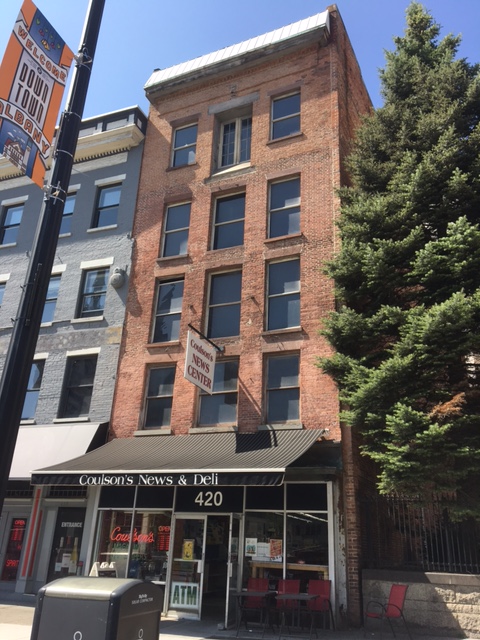
Locate an element on the screen. The height and width of the screenshot is (640, 480). open door is located at coordinates (227, 591).